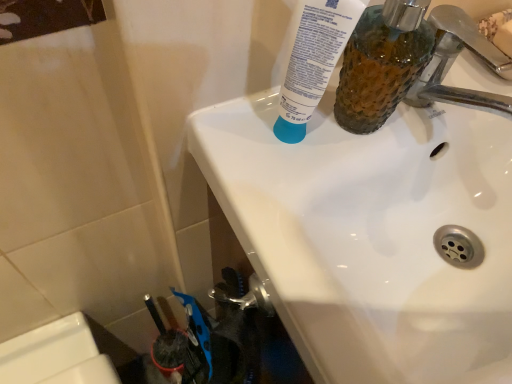
Identify the location of unoccupied area in front of translucent textured mouthwash at upper right. (308, 216).